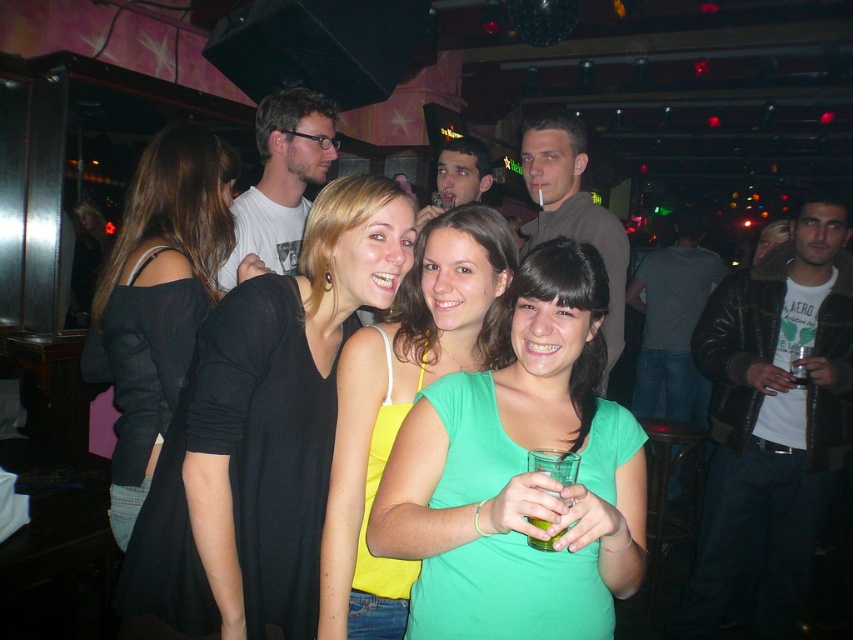
Between green matte shirt at center and white t-shirt at center, which one appears on the right side from the viewer's perspective?

From the viewer's perspective, green matte shirt at center appears more on the right side.

Find the location of `green matte shirt at center`. green matte shirt at center is located at coordinates (520, 474).

Is point (479, 632) closer to camera compared to point (321, 182)?

Yes, it is.

Where is `green matte shirt at center`? This screenshot has height=640, width=853. green matte shirt at center is located at coordinates (520, 474).

What do you see at coordinates (401, 404) in the screenshot? I see `yellow fabric tank top at center` at bounding box center [401, 404].

Does yellow fabric tank top at center have a greater height compared to matte brown jacket at center?

No, yellow fabric tank top at center is not taller than matte brown jacket at center.

Based on the photo, who is more forward, (332, 524) or (627, 252)?

Point (332, 524) is more forward.

You are a GUI agent. You are given a task and a screenshot of the screen. Output one action in this format:
    pyautogui.click(x=<x>, y=<y>)
    Task: Click on the yellow fabric tank top at center
    
    Given the screenshot: What is the action you would take?
    pyautogui.click(x=401, y=404)

Does leather jacket at center come in front of white t-shirt at center?

No, leather jacket at center is behind white t-shirt at center.

Does leather jacket at center have a lesser width compared to white t-shirt at center?

No.

The image size is (853, 640). Describe the element at coordinates (772, 419) in the screenshot. I see `leather jacket at center` at that location.

This screenshot has height=640, width=853. I want to click on leather jacket at center, so click(772, 419).